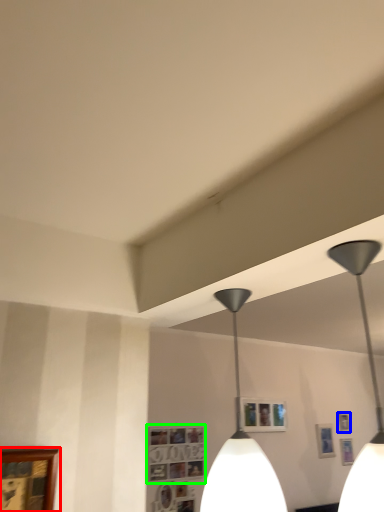
Question: Which object is the closest to the picture frame (highlighted by a red box)? Choose among these: picture frame (highlighted by a blue box) or picture frame (highlighted by a green box).

Choices:
 (A) picture frame
 (B) picture frame

Answer: (B)